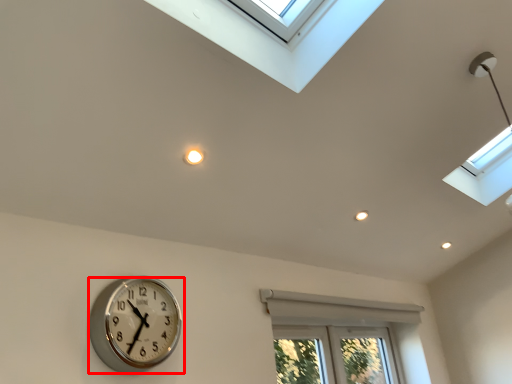
Question: From the image's perspective, where is wall clock (annotated by the red box) located relative to bay window?

Choices:
 (A) below
 (B) above

Answer: (B)